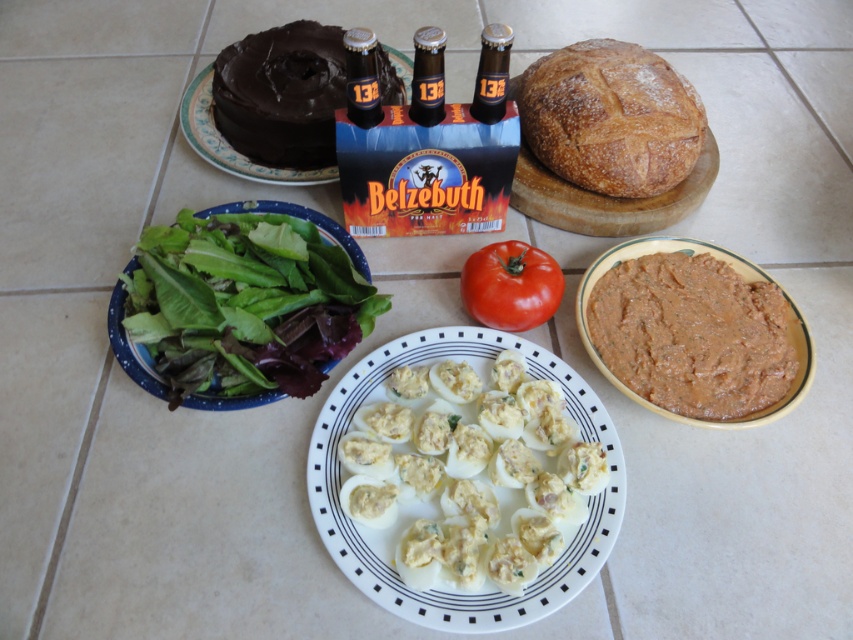
Looking at this image, you are standing in front of the kitchen countertop with the Belfzebuth beer six pack in the center. There are two points marked on the tiled surface. The first point is at coordinates point (218,246) and the second is at point (650,392). Which point is closer to you?

Point (218,246) is closer to you because it is further to the viewer than point (650,392).

You are arranging snacks for a party and see the white creamy deviled eggs at center and the matte brown bottle at center on the counter. Which snack is located to the right of the other?

The white creamy deviled eggs at center is positioned on the right side of matte brown bottle at center.